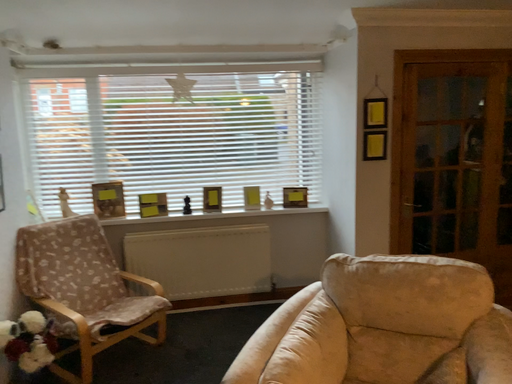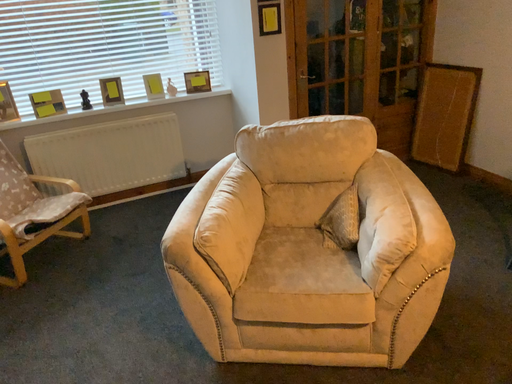
Question: Which way did the camera rotate in the video?

Choices:
 (A) rotated upward
 (B) rotated downward

Answer: (B)